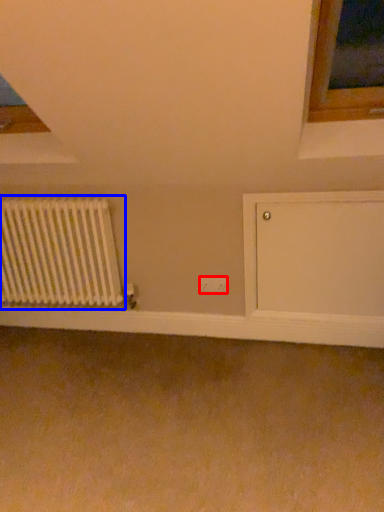
Question: Which point is closer to the camera, electric outlet (highlighted by a red box) or radiator (highlighted by a blue box)?

Choices:
 (A) electric outlet
 (B) radiator

Answer: (B)